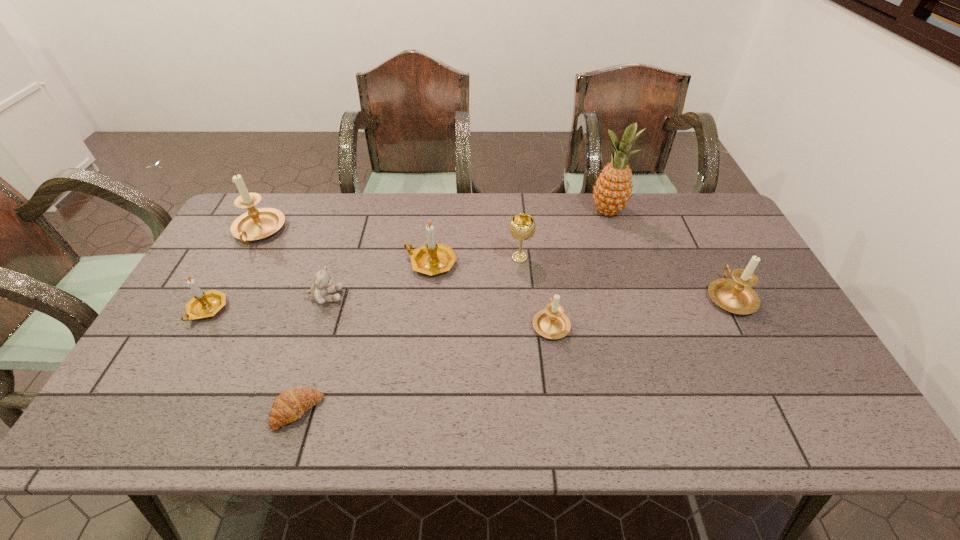
You are a GUI agent. You are given a task and a screenshot of the screen. Output one action in this format:
    pyautogui.click(x=<x>, y=<y>)
    Task: Click on the pineapple
    The width and height of the screenshot is (960, 540).
    Given the screenshot: What is the action you would take?
    pyautogui.click(x=612, y=190)

Find the location of a particular element. The height and width of the screenshot is (540, 960). the eighth object from left to right is located at coordinates (612, 190).

Identify the location of the tallest candle holder. This screenshot has height=540, width=960. (255, 224).

In order to click on the leftmost beige candle holder in this screenshot , I will do `click(255, 224)`.

Where is `the rightmost object`? Image resolution: width=960 pixels, height=540 pixels. the rightmost object is located at coordinates (734, 295).

Identify the location of the rightmost beige candle holder. (734, 295).

Where is `the right gold candle holder`? the right gold candle holder is located at coordinates (433, 258).

Locate an element on the screen. This screenshot has height=540, width=960. the third candle holder from left to right is located at coordinates (433, 258).

Image resolution: width=960 pixels, height=540 pixels. I want to click on chalice, so click(x=522, y=227).

Where is `the second candle holder from right to left`? the second candle holder from right to left is located at coordinates (552, 323).